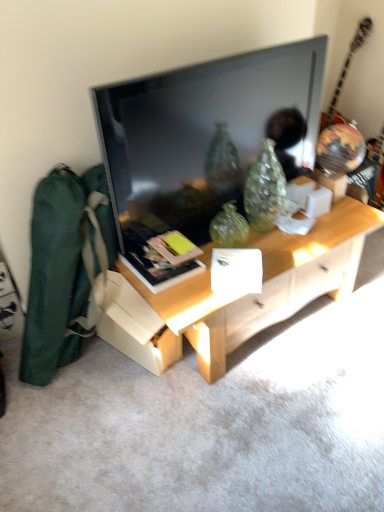
The width and height of the screenshot is (384, 512). I want to click on vacant area that lies in front of light wood desk at center, so click(x=256, y=420).